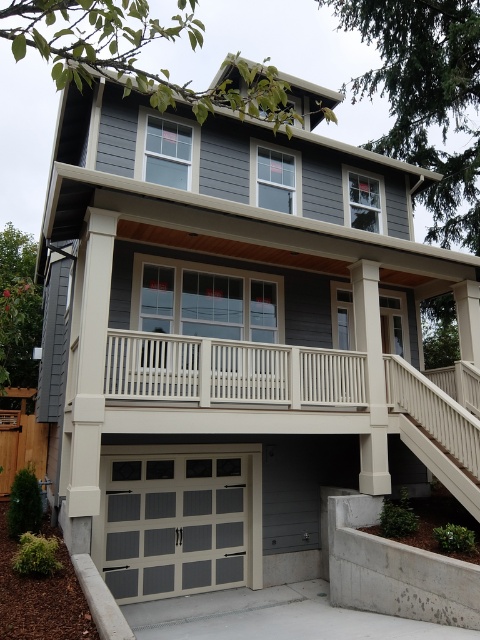
Question: Which point is closer to the camera taking this photo?

Choices:
 (A) (469, 481)
 (B) (167, 461)
 (C) (208, 618)

Answer: (A)

Question: Does matte gray panel garage door at lower center lie behind gray concrete driveway at lower center?

Choices:
 (A) yes
 (B) no

Answer: (A)

Question: Which point is closer to the camera taking this photo?

Choices:
 (A) (316, 580)
 (B) (182, 561)
 (C) (440, 468)

Answer: (C)

Question: Based on their relative distances, which object is nearer to the white textured stairs at lower right?

Choices:
 (A) gray concrete driveway at lower center
 (B) matte gray panel garage door at lower center

Answer: (A)

Question: Does matte gray panel garage door at lower center lie behind gray concrete driveway at lower center?

Choices:
 (A) no
 (B) yes

Answer: (B)

Question: Observing the image, what is the correct spatial positioning of matte gray panel garage door at lower center in reference to white textured stairs at lower right?

Choices:
 (A) left
 (B) right

Answer: (A)